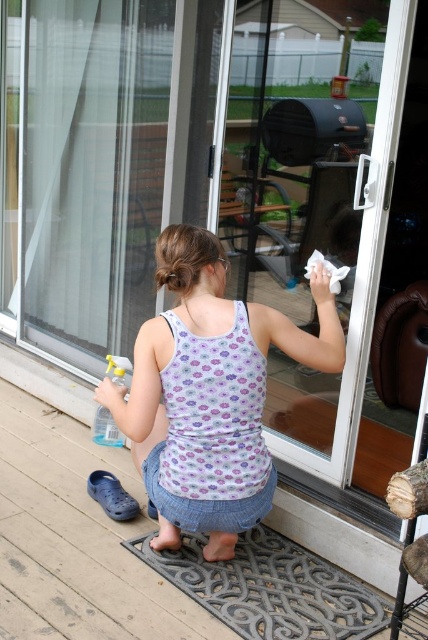
Question: Which point is farther to the camera?

Choices:
 (A) (76, 449)
 (B) (97, 436)
 (C) (140, 410)

Answer: (B)

Question: Can you confirm if floral tank top at center is smaller than wooden deck at lower left?

Choices:
 (A) yes
 (B) no

Answer: (A)

Question: Which point appears farthest from the camera in this image?

Choices:
 (A) (122, 444)
 (B) (228, 545)

Answer: (A)

Question: Which point is farther from the camera taking this photo?

Choices:
 (A) (77, 486)
 (B) (226, 401)
 (C) (92, 428)

Answer: (C)

Question: Does floral tank top at center have a greater width compared to clear plastic spray bottle at lower left?

Choices:
 (A) no
 (B) yes

Answer: (B)

Question: Is floral tank top at center bigger than clear plastic spray bottle at lower left?

Choices:
 (A) no
 (B) yes

Answer: (B)